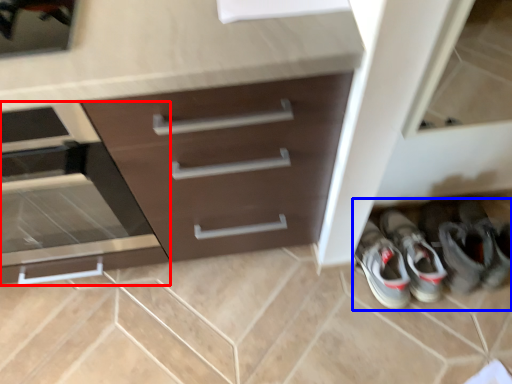
Question: Which point is further to the camera, drawer (highlighted by a red box) or footwear (highlighted by a blue box)?

Choices:
 (A) drawer
 (B) footwear

Answer: (B)